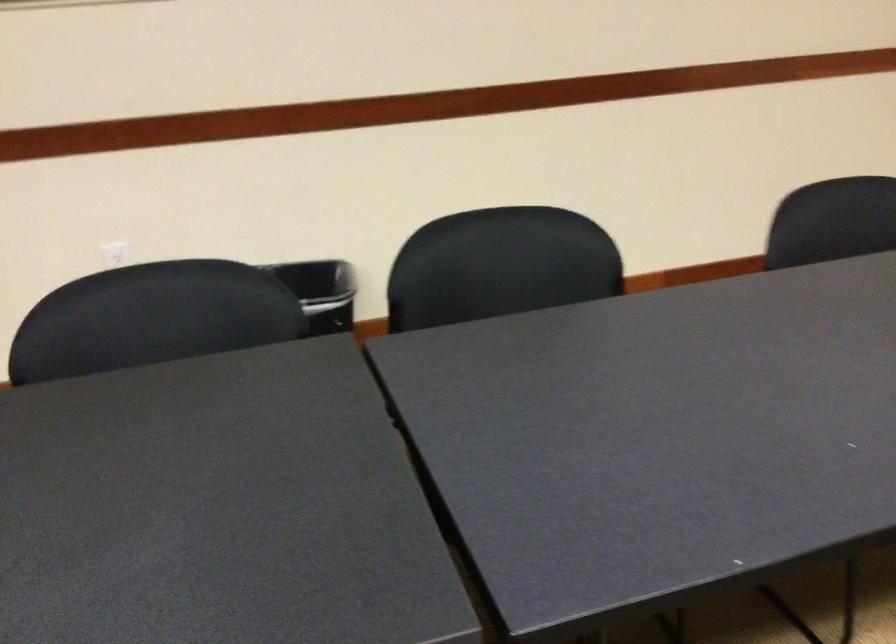
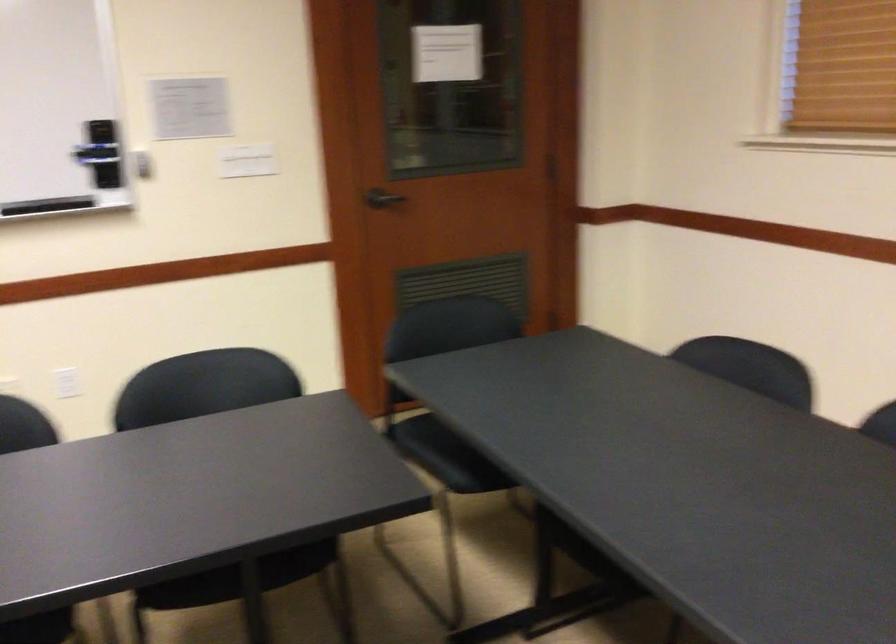
Question: The first image is from the beginning of the video and the second image is from the end. How did the camera likely rotate when shooting the video?

Choices:
 (A) Left
 (B) Right
 (C) Up
 (D) Down

Answer: (A)